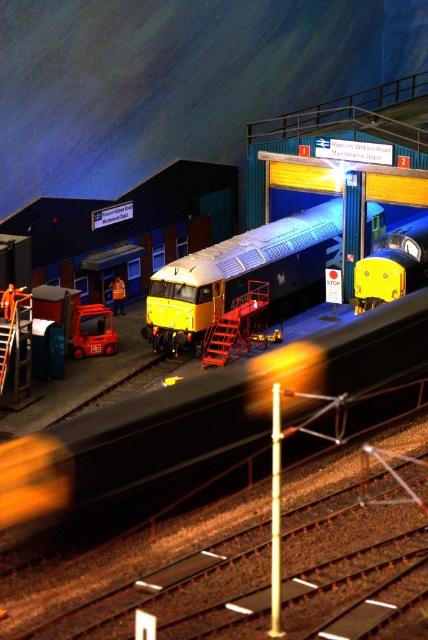
You are a model railway enthusiast who wants to ensure proper spacing between the metallic yellow train at center and the metallic silver train at center in the diorama. According to the manufacturer guidelines, trains must be at least 50 feet apart to avoid collisions. Is the current spacing between them sufficient?

The distance between the metallic yellow train at center and the metallic silver train at center is 52.00 feet, which is more than the required 50 feet. Therefore, the current spacing is sufficient to avoid collisions according to the guidelines.